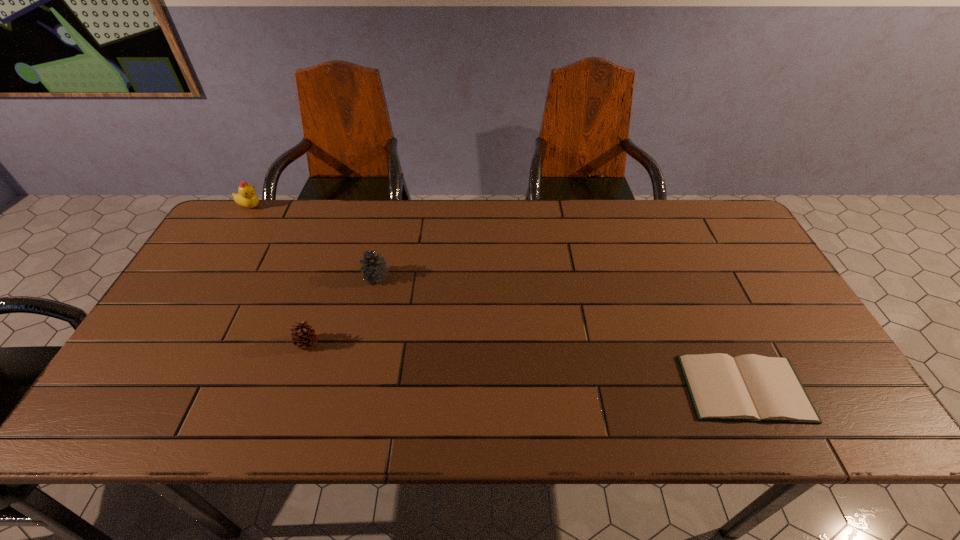
The height and width of the screenshot is (540, 960). In order to click on vacant area located 0.330m on the right of the left pinecone in this screenshot , I will do `click(451, 343)`.

Identify the location of vacant space located on the back of the rightmost object. The height and width of the screenshot is (540, 960). (687, 265).

You are a GUI agent. You are given a task and a screenshot of the screen. Output one action in this format:
    pyautogui.click(x=<x>, y=<y>)
    Task: Click on the object located in the far edge section of the desktop
    This screenshot has height=540, width=960.
    Given the screenshot: What is the action you would take?
    pyautogui.click(x=246, y=197)

At what (x,y) coordinates should I click in order to perform the action: click on object located in the near edge section of the desktop. Please return your answer as a coordinate pair (x, y). Looking at the image, I should click on (748, 388).

Where is `object at the left edge`? object at the left edge is located at coordinates (246, 197).

This screenshot has height=540, width=960. What are the coordinates of `object that is at the right edge` in the screenshot? It's located at (748, 388).

At what (x,y) coordinates should I click in order to perform the action: click on object that is positioned at the far left corner. Please return your answer as a coordinate pair (x, y). Looking at the image, I should click on (246, 197).

This screenshot has height=540, width=960. What are the coordinates of `object present at the near right corner` in the screenshot? It's located at (748, 388).

The height and width of the screenshot is (540, 960). I want to click on vacant space at the far edge of the desktop, so click(x=466, y=244).

You are a GUI agent. You are given a task and a screenshot of the screen. Output one action in this format:
    pyautogui.click(x=<x>, y=<y>)
    Task: Click on the free space at the near edge of the desktop
    
    Given the screenshot: What is the action you would take?
    pyautogui.click(x=550, y=408)